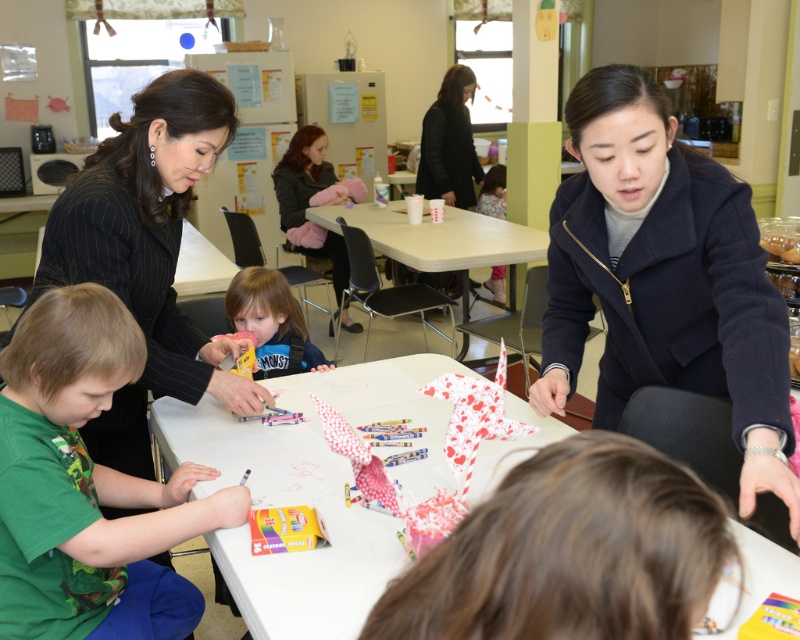
From the picture: You are a teacher who needs to place a 90 cm wide whiteboard between the smooth plastic table at center and the black fabric woman at upper center. Is there enough space between them to fit the whiteboard?

The smooth plastic table at center and black fabric woman at upper center are 89.98 centimeters apart from each other. Since the whiteboard is 90 cm wide, there is not enough space to fit it between them.

You are a visitor entering the classroom and need to locate both the navy wool coat at center and the black pinstripe suit at upper left. Which one do you see first upon entering?

The black pinstripe suit at upper left is seen first because it is positioned higher up, while the navy wool coat at center is located below it.

You are a teacher organizing a classroom activity. You need to place a new set of art supplies on the table. However, the navy wool coat at center is currently occupying space on the white paper table at center. Based on their positions, can the supplies be placed on the table without moving the coat?

The navy wool coat at center is positioned on the right side of the white paper table at center. Since the coat is only on the right side, there might still be space on the left side of the table to place the art supplies without moving the coat.